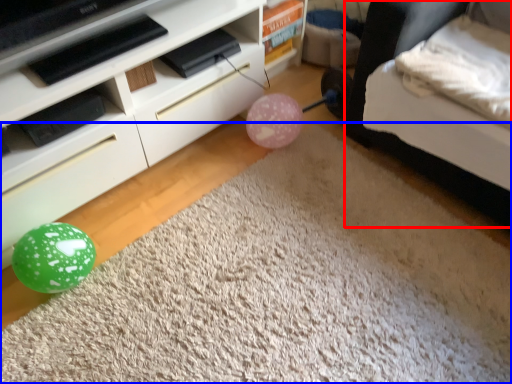
Question: Which of the following is the closest to the observer, bed (highlighted by a red box) or plain (highlighted by a blue box)?

Choices:
 (A) bed
 (B) plain

Answer: (B)